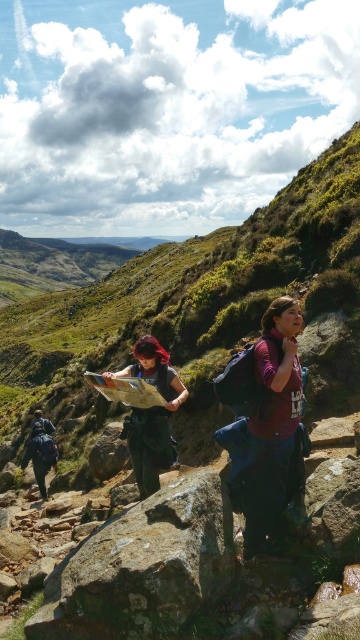
You are a hiker planning to use the dark blue fabric map at center to navigate the rocky trail. Since the map is small, will you be able to see all the details clearly if you compare it to the dark blue backpack at lower left?

The dark blue fabric map at center is smaller than the dark blue backpack at lower left, so it might be harder to see all the details clearly compared to the size of the dark blue backpack at lower left. Consider using a magnifying tool or a larger map for better visibility.

You are a hiker trying to locate the green mossy rock at center while following the trail. Based on the coordinates provided, where should you look relative to your current position on the trail?

The green mossy rock at center is located at coordinates 0.887 along the x axis and 0.400 along the y axis, so you should look towards the right and slightly forward from your current position on the trail.

You are a hiker trying to place your dark blue backpack at lower left on the green mossy rock at center. Based on their sizes, will the backpack fit on the rock?

The green mossy rock at center is not as tall as the dark blue backpack at lower left, so the backpack may be too tall to fit on the rock.